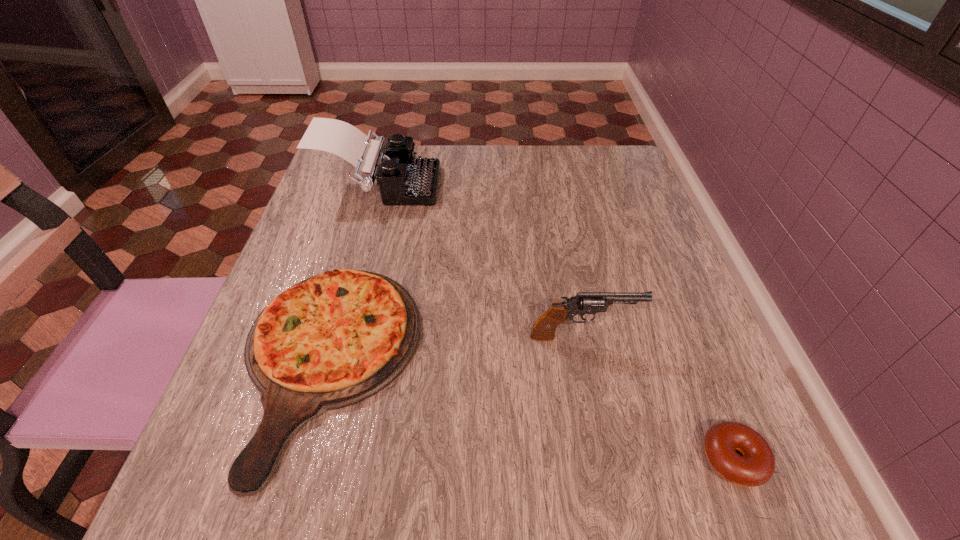
Locate an element on the screen. The height and width of the screenshot is (540, 960). object at the near right corner is located at coordinates click(x=756, y=466).

In order to click on vacant region at the far edge of the desktop in this screenshot , I will do `click(519, 161)`.

You are a GUI agent. You are given a task and a screenshot of the screen. Output one action in this format:
    pyautogui.click(x=<x>, y=<y>)
    Task: Click on the blank space at the near edge of the desktop
    The image size is (960, 540).
    Given the screenshot: What is the action you would take?
    pyautogui.click(x=373, y=495)

In the image, there is a desktop. Where is `blank space at the left edge`? blank space at the left edge is located at coordinates (300, 259).

Image resolution: width=960 pixels, height=540 pixels. I want to click on vacant space at the right edge of the desktop, so click(668, 314).

This screenshot has height=540, width=960. In the image, there is a desktop. What are the coordinates of `vacant space at the near left corner` in the screenshot? It's located at (191, 515).

Locate an element on the screen. This screenshot has height=540, width=960. vacant space at the far right corner of the desktop is located at coordinates (623, 185).

Image resolution: width=960 pixels, height=540 pixels. Find the location of `vacant space at the near right corner of the desktop`. vacant space at the near right corner of the desktop is located at coordinates (666, 487).

Locate an element on the screen. free spot between the farthest object and the gun is located at coordinates (481, 262).

The height and width of the screenshot is (540, 960). I want to click on free space between the farthest object and the third shortest object, so (481, 262).